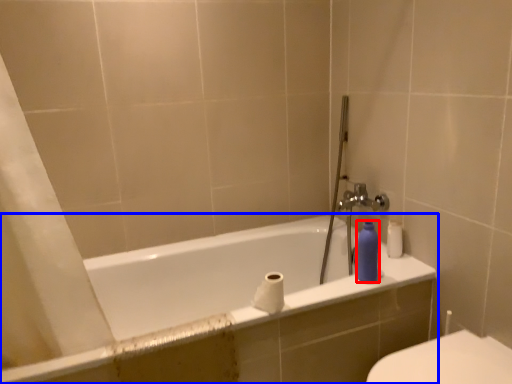
Question: Among these objects, which one is farthest to the camera, toiletry (highlighted by a red box) or bathtub (highlighted by a blue box)?

Choices:
 (A) toiletry
 (B) bathtub

Answer: (A)